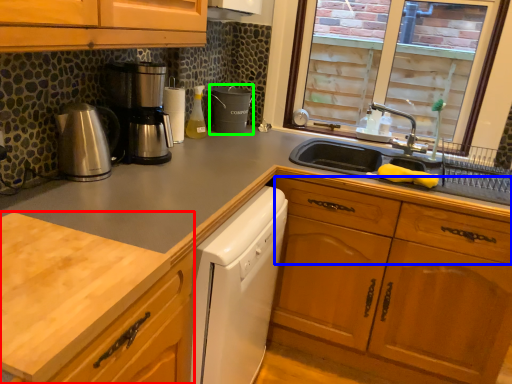
Question: Which object is the closest to the countertop (highlighted by a red box)? Choose among these: drawer (highlighted by a blue box) or appliance (highlighted by a green box).

Choices:
 (A) drawer
 (B) appliance

Answer: (A)